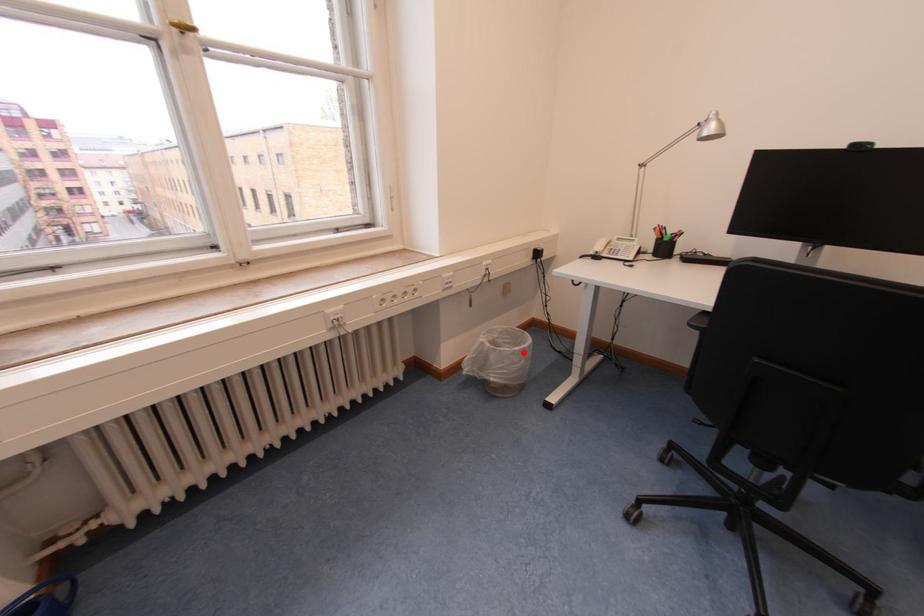
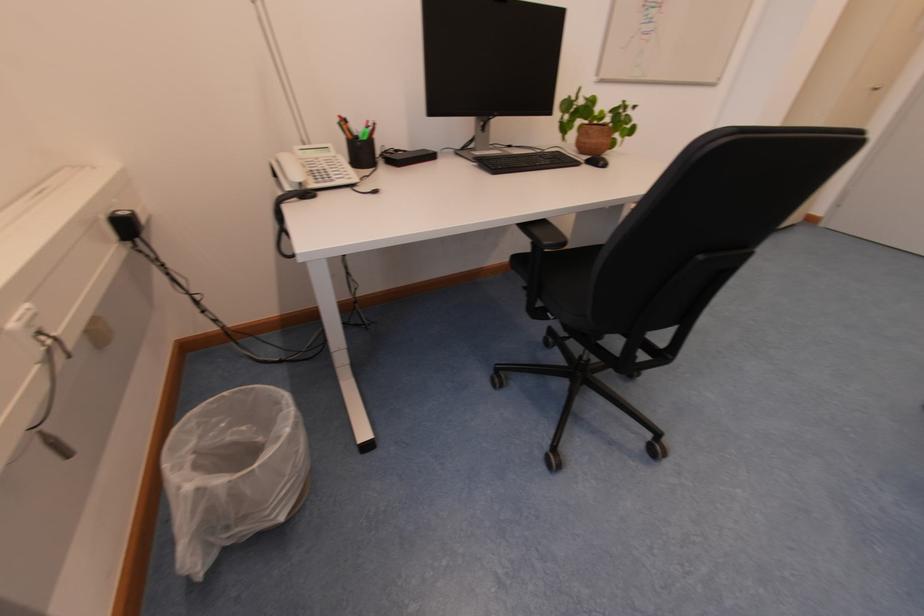
In the second image, find the point that corresponds to the highlighted location in the first image.

(296, 437)